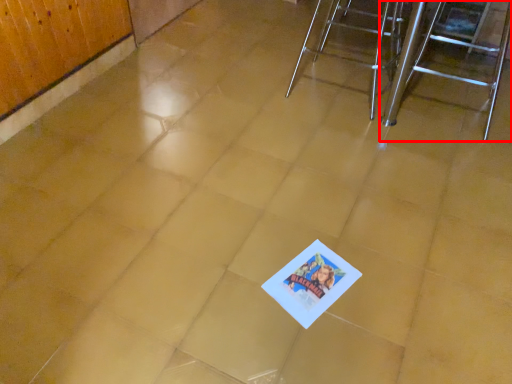
Question: From the image's perspective, where is furniture (annotated by the red box) located relative to furniture?

Choices:
 (A) above
 (B) below

Answer: (B)